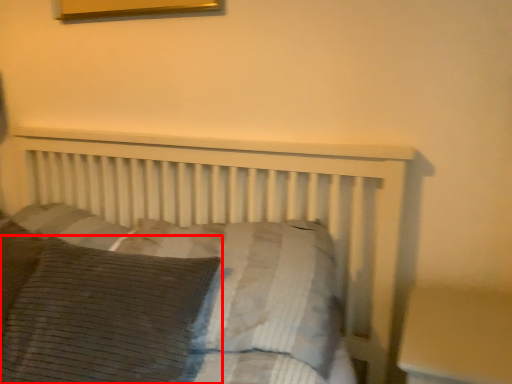
Question: Considering the relative positions of pillow (annotated by the red box) and pillow in the image provided, where is pillow (annotated by the red box) located with respect to the staircase?

Choices:
 (A) right
 (B) left

Answer: (B)